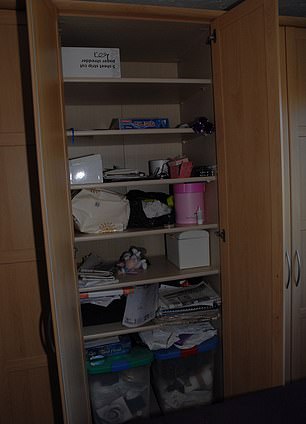
Image resolution: width=306 pixels, height=424 pixels. In order to click on closed cabinets in this screenshot , I will do `click(294, 215)`, `click(286, 235)`.